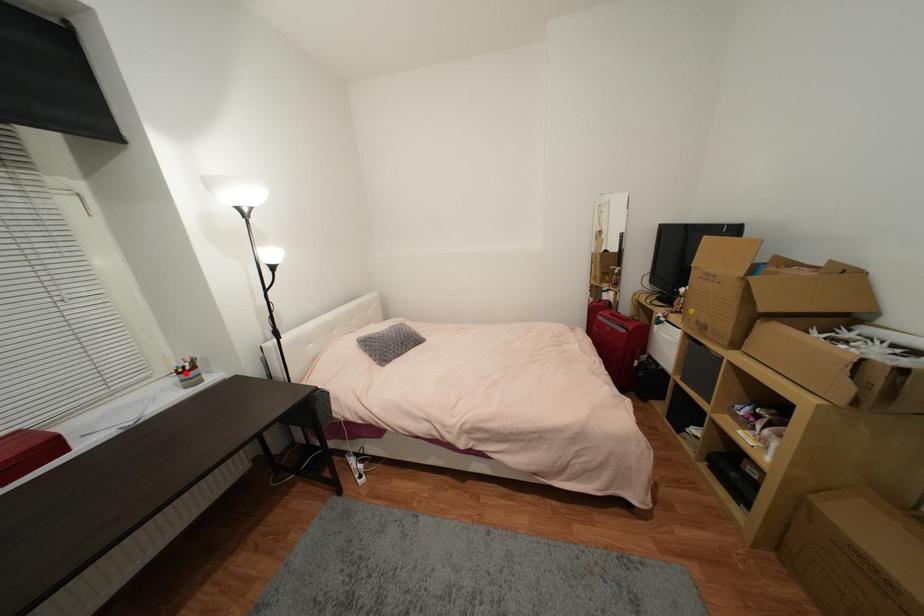
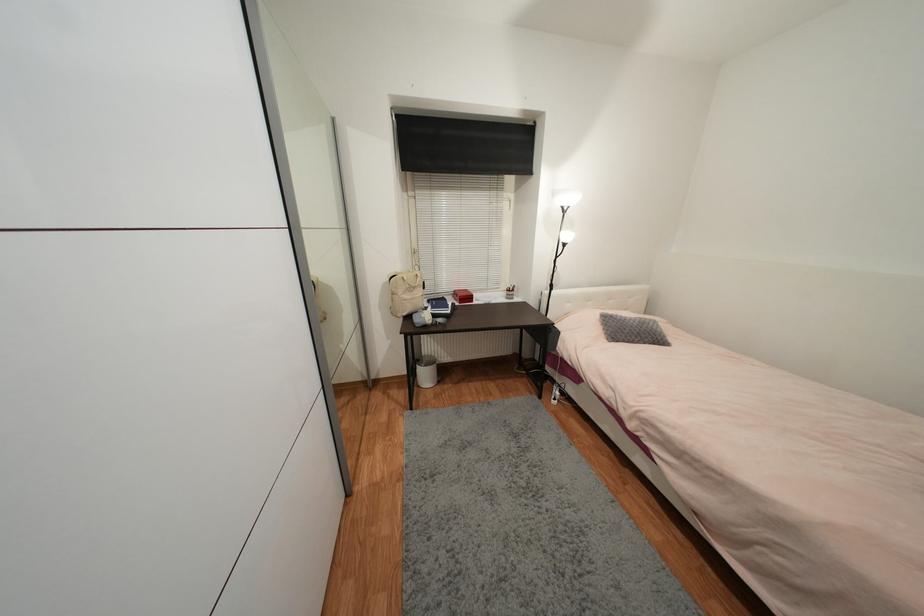
Where in the second image is the point corresponding to the highlighted location from the first image?

(513, 292)